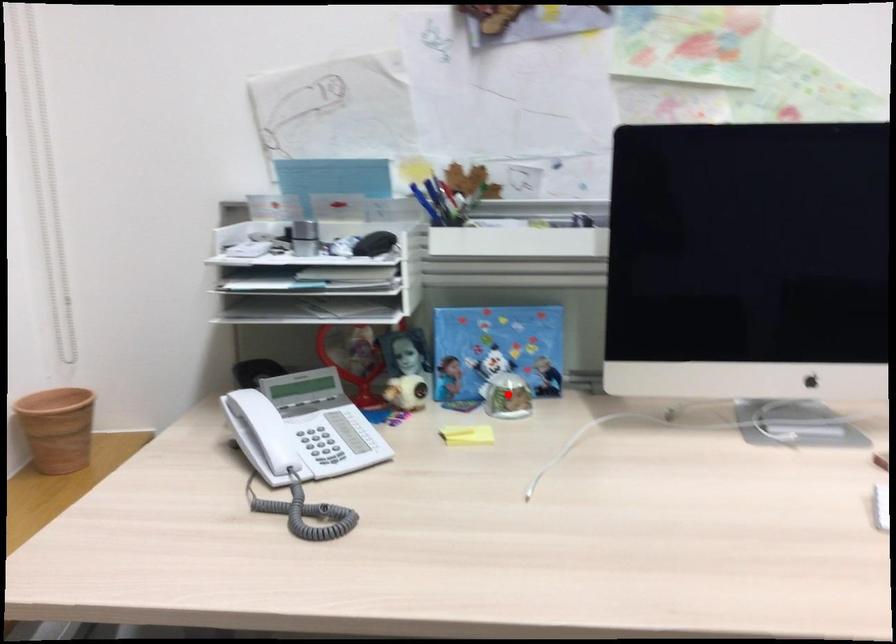
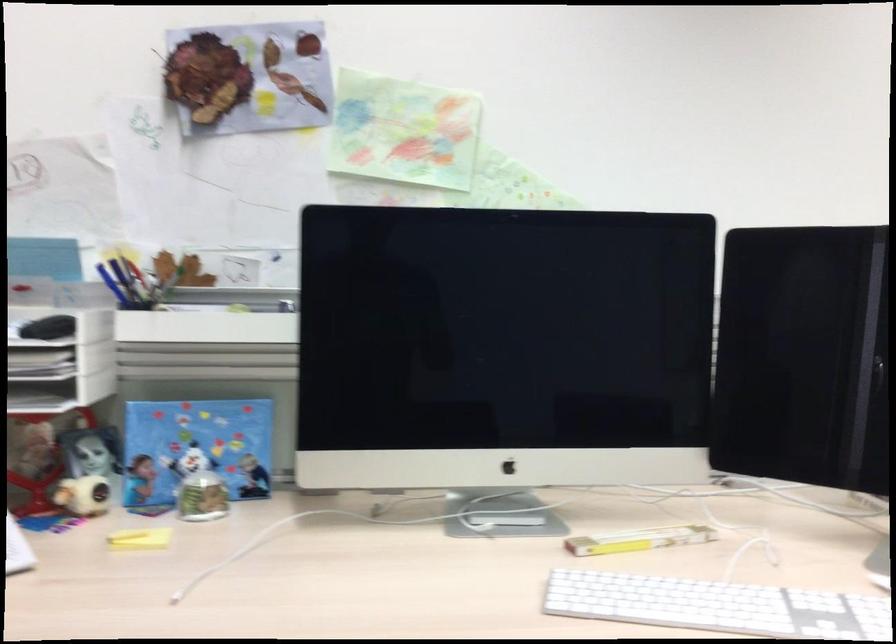
Locate, in the second image, the point that corresponds to the highlighted location in the first image.

(202, 497)